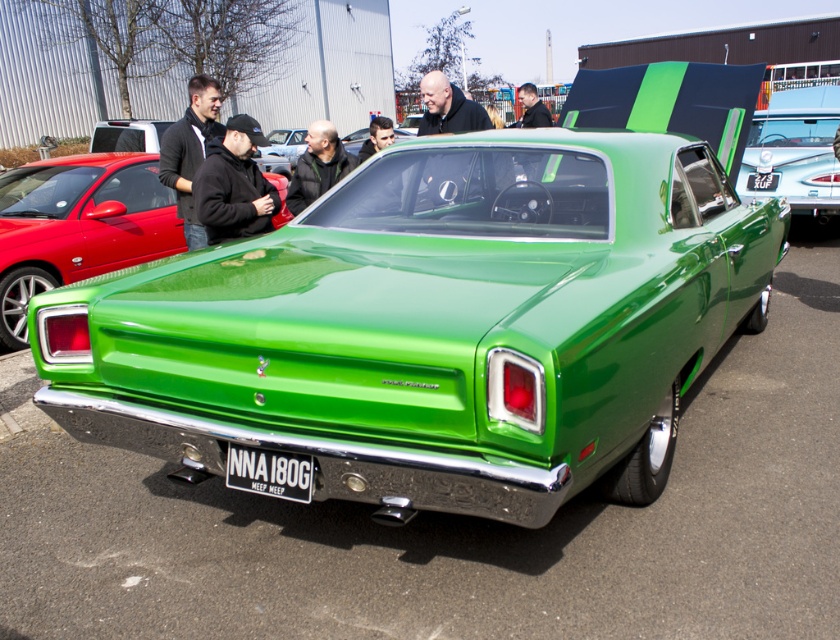
Question: Does green glossy sedan at center have a greater width compared to smooth black jacket at center?

Choices:
 (A) no
 (B) yes

Answer: (B)

Question: Does matte red sedan at left have a greater width compared to black metal license plate at center?

Choices:
 (A) yes
 (B) no

Answer: (A)

Question: Which of the following is the farthest from the observer?

Choices:
 (A) green glossy sedan at center
 (B) black matte jacket at upper center

Answer: (B)

Question: Which point is closer to the camera?

Choices:
 (A) (463, 364)
 (B) (264, 483)
 (C) (306, 132)

Answer: (A)

Question: Is green glossy sedan at center below matte black jacket at upper left?

Choices:
 (A) no
 (B) yes

Answer: (B)

Question: Which object is positioned farthest from the green glossy sedan at center?

Choices:
 (A) green glossy car at center
 (B) black fleece jacket at center
 (C) smooth black hair at center

Answer: (A)